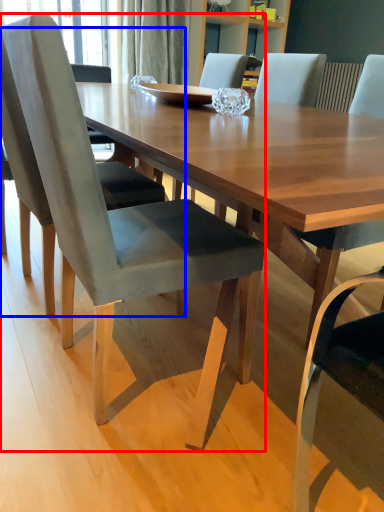
Question: Which object appears closest to the camera in this image, chair (highlighted by a red box) or chair (highlighted by a blue box)?

Choices:
 (A) chair
 (B) chair

Answer: (A)